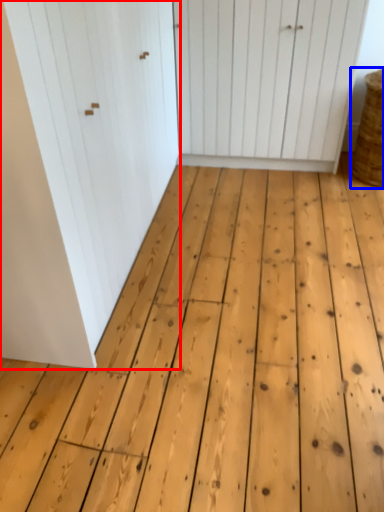
Question: Which of the following is the closest to the observer, door (highlighted by a red box) or basket (highlighted by a blue box)?

Choices:
 (A) door
 (B) basket

Answer: (A)